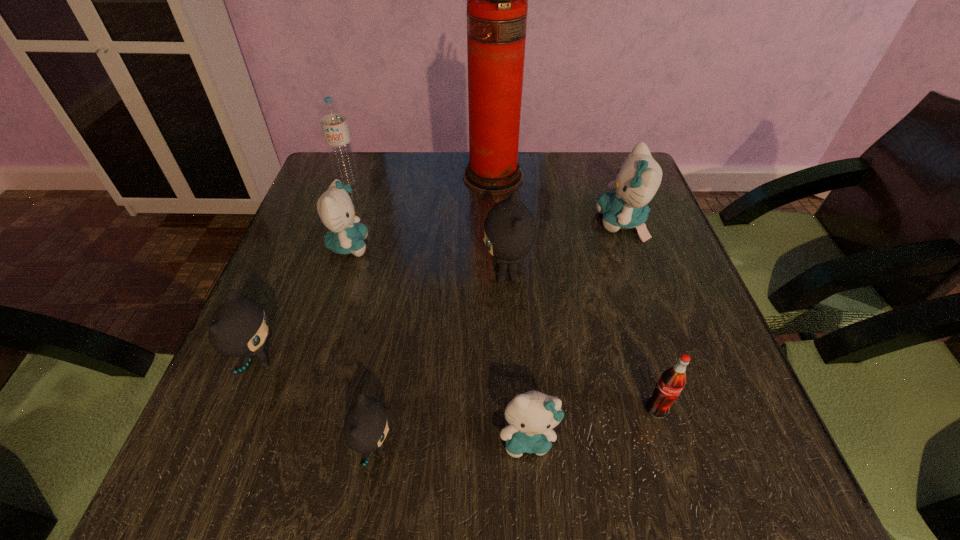
The height and width of the screenshot is (540, 960). Find the location of `the second biggest gray kitten`. the second biggest gray kitten is located at coordinates (238, 328).

The height and width of the screenshot is (540, 960). Identify the location of the smallest blue kitten. (531, 416).

Locate an element on the screen. the nearest blue kitten is located at coordinates click(531, 416).

Where is `the sixth object from right to left`? The width and height of the screenshot is (960, 540). the sixth object from right to left is located at coordinates (365, 426).

The height and width of the screenshot is (540, 960). What are the coordinates of `the nearest gray kitten` in the screenshot? It's located at (365, 426).

Identify the location of free space located at the discharge end of the fire extinguisher. (320, 177).

Locate an element on the screen. free region located 0.200m at the discharge end of the fire extinguisher is located at coordinates (390, 177).

Where is `free space located 0.380m at the discharge end of the fire extinguisher`? free space located 0.380m at the discharge end of the fire extinguisher is located at coordinates (324, 177).

Where is `vacant space situated on the right of the water bottle`? vacant space situated on the right of the water bottle is located at coordinates (394, 182).

Find the location of a particular element. The width and height of the screenshot is (960, 540). vacant space located on the face of the rightmost blue kitten is located at coordinates (447, 222).